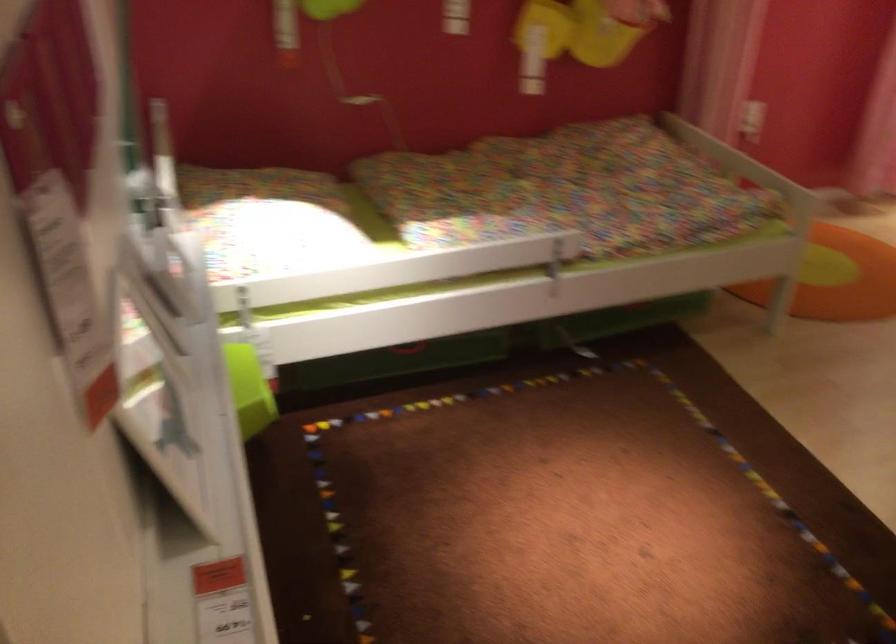
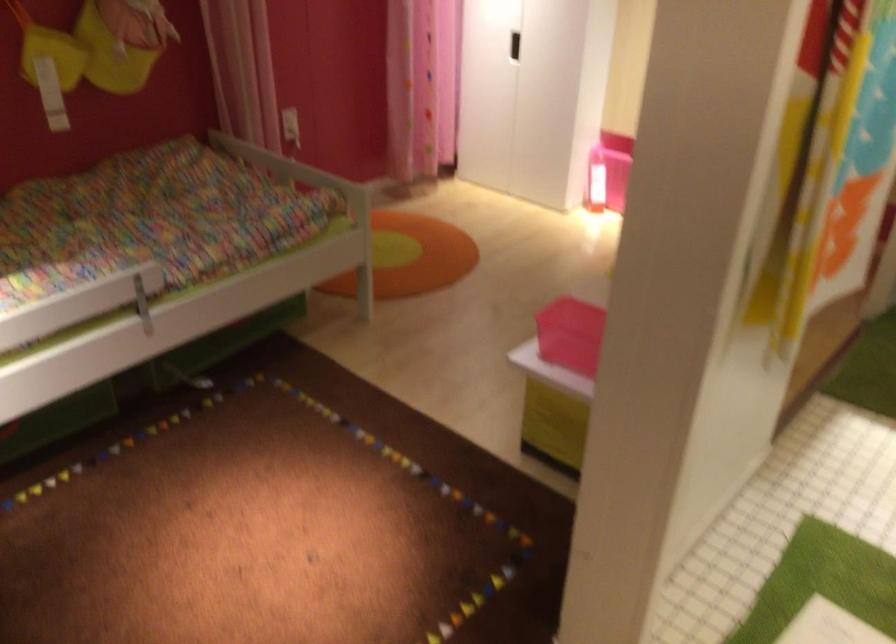
Locate, in the second image, the point that corresponds to pixel 752 156 in the first image.

(297, 172)